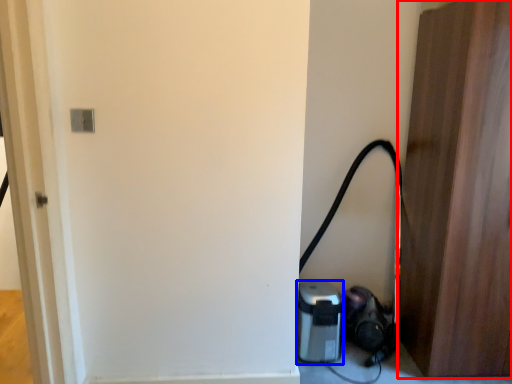
Question: Which point is further to the camera, door (highlighted by a red box) or appliance (highlighted by a blue box)?

Choices:
 (A) door
 (B) appliance

Answer: (B)